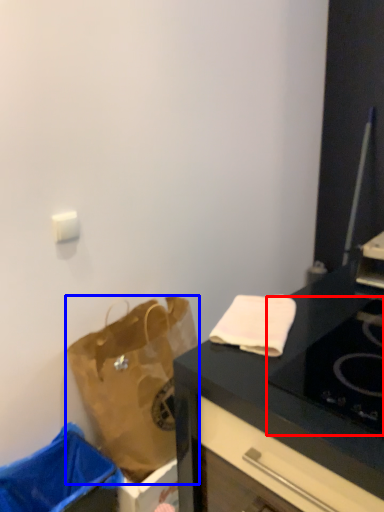
Question: Among these objects, which one is farthest to the camera, gas stove (highlighted by a red box) or handbag (highlighted by a blue box)?

Choices:
 (A) gas stove
 (B) handbag

Answer: (B)